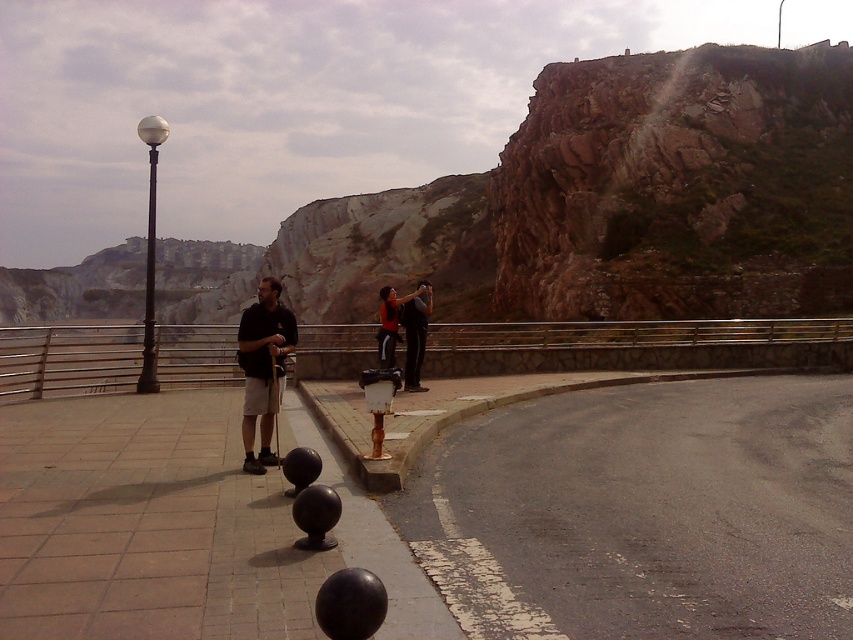
Does rugged rock cliff at upper right have a greater height compared to black matte shirt at center?

Yes.

At what (x,y) coordinates should I click in order to perform the action: click on rugged rock cliff at upper right. Please return your answer as a coordinate pair (x, y). Image resolution: width=853 pixels, height=640 pixels. Looking at the image, I should click on (680, 186).

In order to click on rugged rock cliff at upper right in this screenshot , I will do `click(680, 186)`.

Is black matte shirt at center below matte black jacket at center?

Yes, black matte shirt at center is below matte black jacket at center.

Where is `black matte shirt at center`? The height and width of the screenshot is (640, 853). black matte shirt at center is located at coordinates (262, 365).

Where is `black matte shirt at center`? black matte shirt at center is located at coordinates (262, 365).

Is black metal bollards at center further to the viewer compared to dark gray pants at center?

No, black metal bollards at center is closer to the viewer.

Image resolution: width=853 pixels, height=640 pixels. Describe the element at coordinates (177, 525) in the screenshot. I see `black metal bollards at center` at that location.

At what (x,y) coordinates should I click in order to perform the action: click on black metal bollards at center. Please return your answer as a coordinate pair (x, y). The width and height of the screenshot is (853, 640). Looking at the image, I should click on (177, 525).